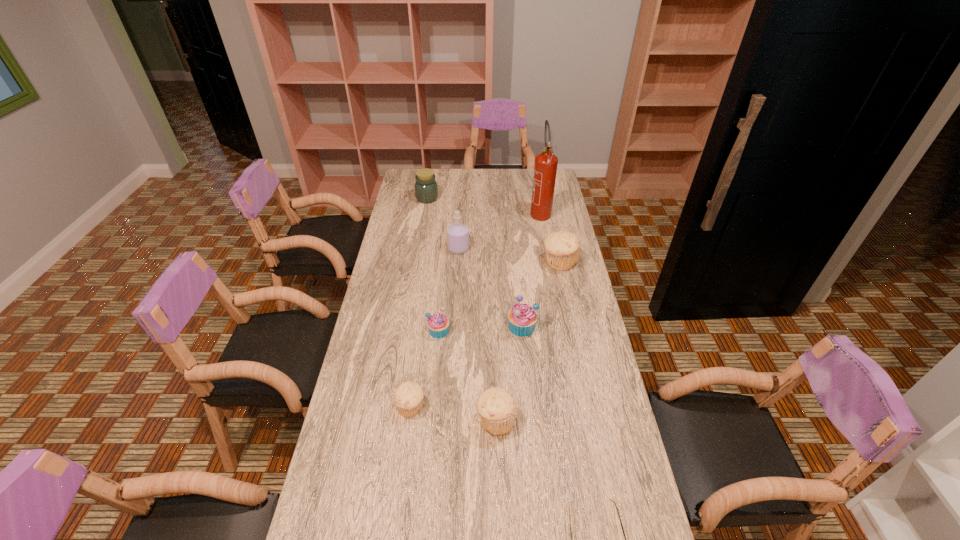
Where is `beige muffin identified as the third closest to the perfume`? beige muffin identified as the third closest to the perfume is located at coordinates (497, 408).

The image size is (960, 540). What are the coordinates of `free space that satisfies the following two spatial constraints: 1. on the front side of the eighth shortest object; 2. on the left side of the second beige muffin from right to left` in the screenshot? It's located at (448, 420).

Identify the location of blank space that satisfies the following two spatial constraints: 1. on the back side of the left blue muffin; 2. on the right side of the biggest beige muffin. (445, 262).